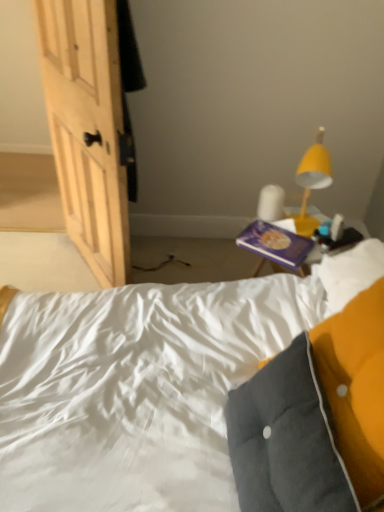
Question: Should I look upward or downward to see velvety gray pillow at lower right?

Choices:
 (A) down
 (B) up

Answer: (A)

Question: Does purple matte book at upper right appear on the right side of yellow matte lamp at upper right?

Choices:
 (A) no
 (B) yes

Answer: (A)

Question: Is purple matte book at upper right outside yellow matte lamp at upper right?

Choices:
 (A) no
 (B) yes

Answer: (B)

Question: Is the position of purple matte book at upper right less distant than that of yellow matte lamp at upper right?

Choices:
 (A) yes
 (B) no

Answer: (B)

Question: Is purple matte book at upper right at the left side of yellow matte lamp at upper right?

Choices:
 (A) yes
 (B) no

Answer: (A)

Question: Is purple matte book at upper right further to camera compared to yellow matte lamp at upper right?

Choices:
 (A) yes
 (B) no

Answer: (A)

Question: Is purple matte book at upper right positioned far away from yellow matte lamp at upper right?

Choices:
 (A) no
 (B) yes

Answer: (A)

Question: Is yellow matte lamp at upper right behind velvety gray pillow at lower right?

Choices:
 (A) no
 (B) yes

Answer: (B)

Question: Can we say yellow matte lamp at upper right lies outside velvety gray pillow at lower right?

Choices:
 (A) no
 (B) yes

Answer: (B)

Question: Does yellow matte lamp at upper right have a larger size compared to velvety gray pillow at lower right?

Choices:
 (A) yes
 (B) no

Answer: (B)

Question: Is yellow matte lamp at upper right positioned in front of velvety gray pillow at lower right?

Choices:
 (A) no
 (B) yes

Answer: (A)

Question: Does yellow matte lamp at upper right have a greater height compared to velvety gray pillow at lower right?

Choices:
 (A) yes
 (B) no

Answer: (B)

Question: Is yellow matte lamp at upper right smaller than velvety gray pillow at lower right?

Choices:
 (A) yes
 (B) no

Answer: (A)

Question: Is velvety gray pillow at lower right oriented towards yellow matte lamp at upper right?

Choices:
 (A) no
 (B) yes

Answer: (A)